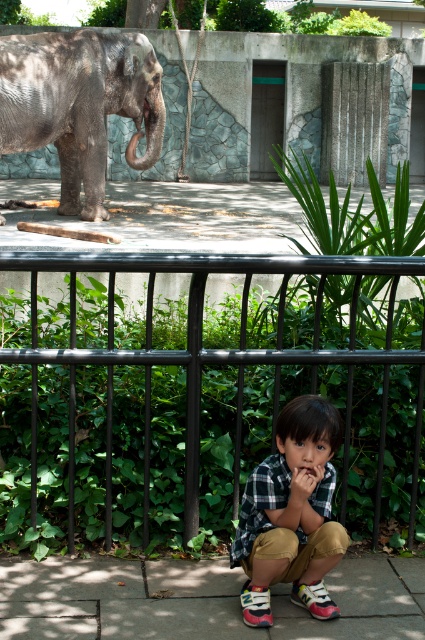
You are a zookeeper trying to ensure safety. The black metal fence at center and the pink matte lips at center are both in your line of sight. Which object is wider from your perspective?

The black metal fence at center is wider than the pink matte lips at center.

You are a zookeeper who needs to locate the black metal fence at center in the image. Where exactly is it positioned?

The black metal fence at center is located at point (203, 396).

You are a zookeeper responsible for ensuring visitor safety. You notice a child crouching near the black metal railing that separates them from the elephant enclosure. The gray textured elephant at upper left and the pink matte lips at center are visible. Based on their sizes, which object might pose a greater risk if the child tries to reach over the railing?

The gray textured elephant at upper left is larger in width than the pink matte lips at center, so it might pose a greater risk if the child tries to reach over the railing because its larger size could make it harder for the child to maintain balance or distance.